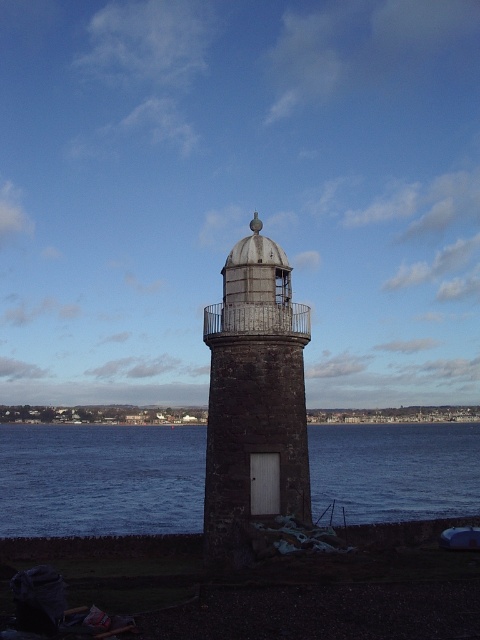
You are standing at the base of the dark gray stone tower at center and want to reach the blue water at center. In which direction should you walk?

You should walk to the right to reach the blue water at center, as it is located to the right of the dark gray stone tower at center.

You are a bird flying over the lighthouse scene. You want to land on the dark gray stone tower at center but first need to pass over the blue water at center. Which object will you encounter first?

The blue water at center is in front of the dark gray stone tower at center, so you will encounter the blue water at center first before reaching the dark gray stone tower at center.

You are a painter who wants to capture the lighthouse scene. You have a canvas that can only fit objects up to 2 meters wide. You see the blue water at center and the dark gray stone tower at center. Which object should you focus on to ensure it fits on your canvas?

The blue water at center might be wider than dark gray stone tower at center, so focusing on the dark gray stone tower at center would be better to ensure it fits on the 2 meter wide canvas.